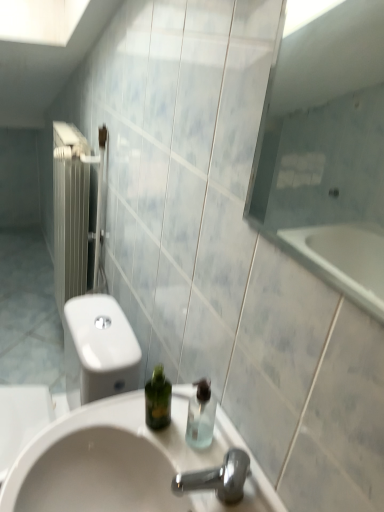
Question: In terms of size, does white glossy sink at center appear bigger or smaller than transparent plastic soap dispenser at center?

Choices:
 (A) big
 (B) small

Answer: (A)

Question: From their relative heights in the image, would you say white glossy sink at center is taller or shorter than transparent plastic soap dispenser at center?

Choices:
 (A) short
 (B) tall

Answer: (B)

Question: Based on their relative distances, which object is farther from the transparent plastic soap dispenser at center?

Choices:
 (A) transparent glass shower at right
 (B) white glossy sink at center

Answer: (A)

Question: Which of these objects is positioned farthest from the transparent plastic soap dispenser at center?

Choices:
 (A) white glossy sink at center
 (B) transparent glass shower at right

Answer: (B)